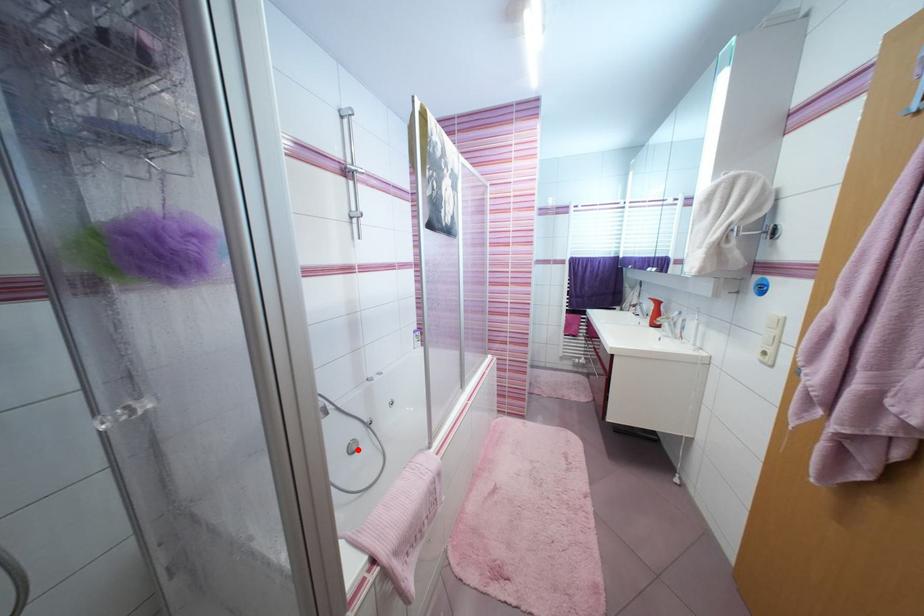
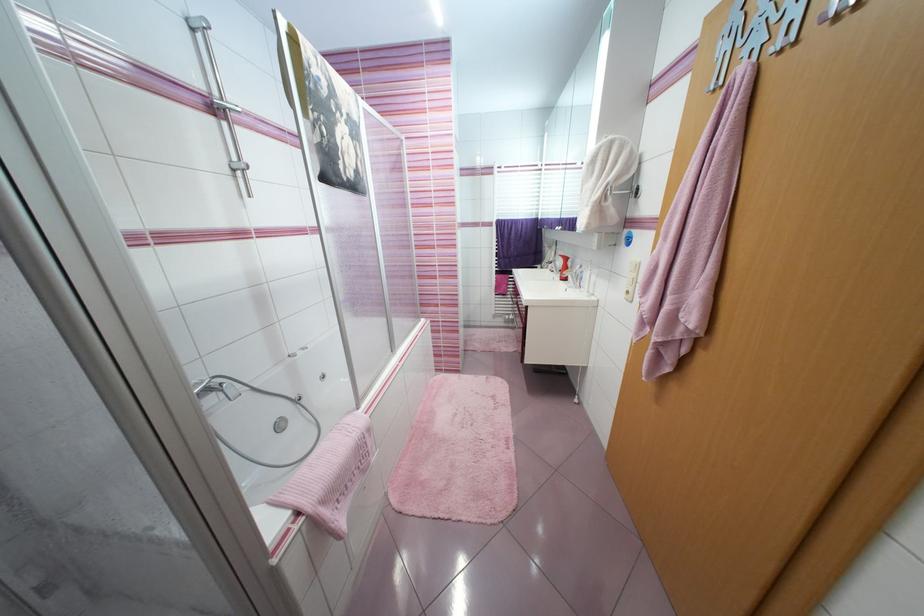
Question: I am providing you with two images of the same scene from different viewpoints. A red point is shown in image1. For the corresponding object point in image2, is it positioned nearer or farther from the camera?

Choices:
 (A) Nearer
 (B) Farther

Answer: (A)